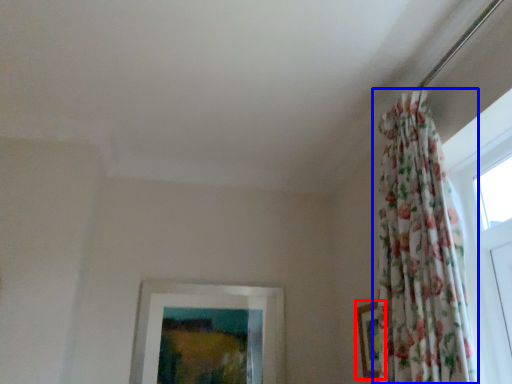
Question: Among these objects, which one is farthest to the camera, picture frame (highlighted by a red box) or curtain (highlighted by a blue box)?

Choices:
 (A) picture frame
 (B) curtain

Answer: (A)